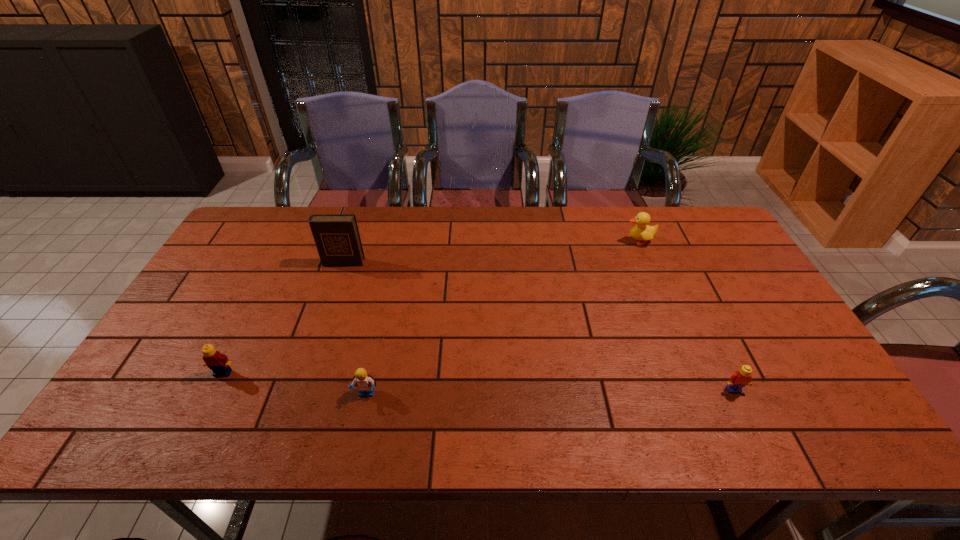
The width and height of the screenshot is (960, 540). What are the coordinates of `unoccupied area between the third object from right to left and the tallest object` in the screenshot? It's located at (354, 328).

At what (x,y) coordinates should I click in order to perform the action: click on vacant region between the duckling and the third nearest object. Please return your answer as a coordinate pair (x, y). The width and height of the screenshot is (960, 540). Looking at the image, I should click on [431, 307].

You are a GUI agent. You are given a task and a screenshot of the screen. Output one action in this format:
    pyautogui.click(x=<x>, y=<y>)
    Task: Click on the free space between the leftmost Lego and the diary
    
    Given the screenshot: What is the action you would take?
    pyautogui.click(x=283, y=318)

You are a GUI agent. You are given a task and a screenshot of the screen. Output one action in this format:
    pyautogui.click(x=<x>, y=<y>)
    Task: Click on the empty space between the tallest object and the rightmost Lego
    Image resolution: width=960 pixels, height=540 pixels.
    Given the screenshot: What is the action you would take?
    pyautogui.click(x=539, y=326)

At what (x,y) coordinates should I click in order to perform the action: click on free space between the second Lego from right to left and the leftmost Lego. Please return your answer as a coordinate pair (x, y). This screenshot has height=540, width=960. Looking at the image, I should click on (295, 383).

The image size is (960, 540). Find the location of `vacant area between the second object from left to right and the rightmost Lego`. vacant area between the second object from left to right and the rightmost Lego is located at coordinates (539, 326).

Where is `empty space that is in between the second object from left to right and the farthest Lego`? empty space that is in between the second object from left to right and the farthest Lego is located at coordinates (283, 318).

Where is `vacant area that lies between the fourth nearest object and the third nearest object`? The height and width of the screenshot is (540, 960). vacant area that lies between the fourth nearest object and the third nearest object is located at coordinates (283, 318).

The image size is (960, 540). Identify the location of vacant region between the second Lego from right to left and the farthest Lego. (295, 383).

Identify the location of free space between the leftmost object and the tallest object. This screenshot has width=960, height=540. (283, 318).